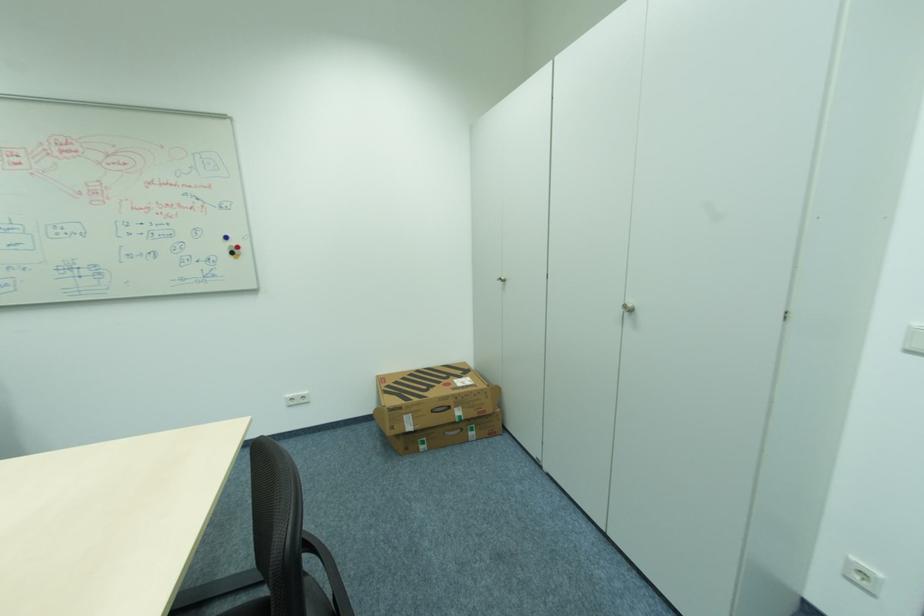
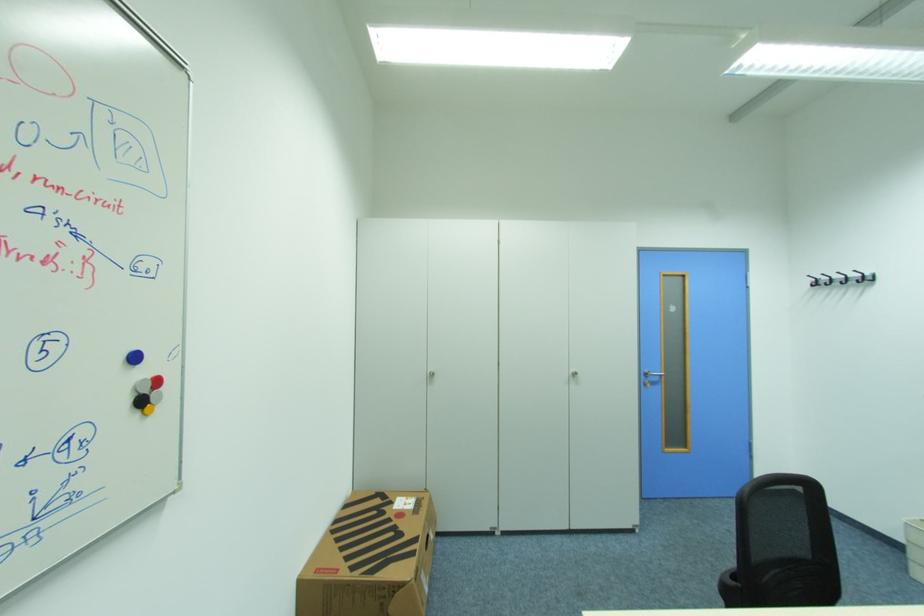
Find the pixel in the second image that matches (237,254) in the first image.

(146, 403)